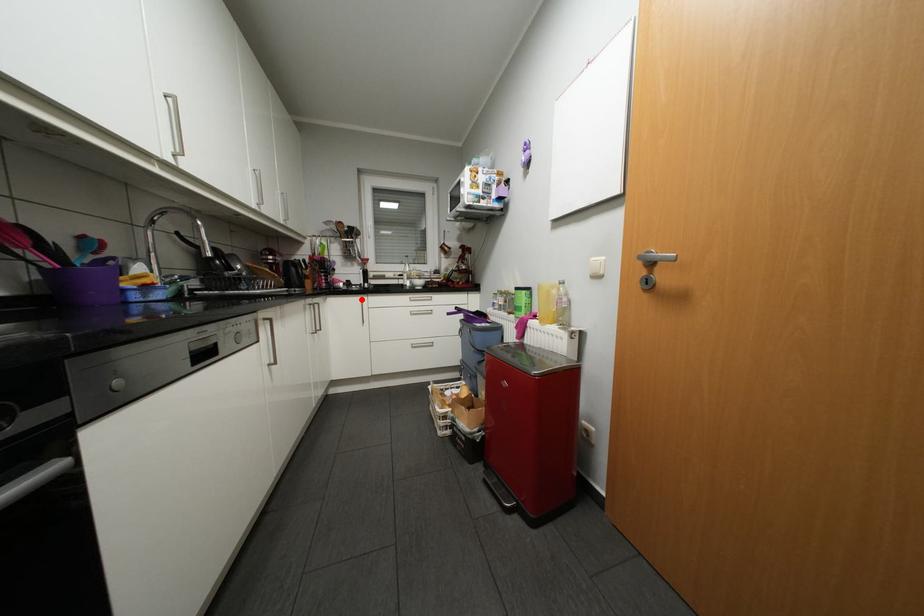
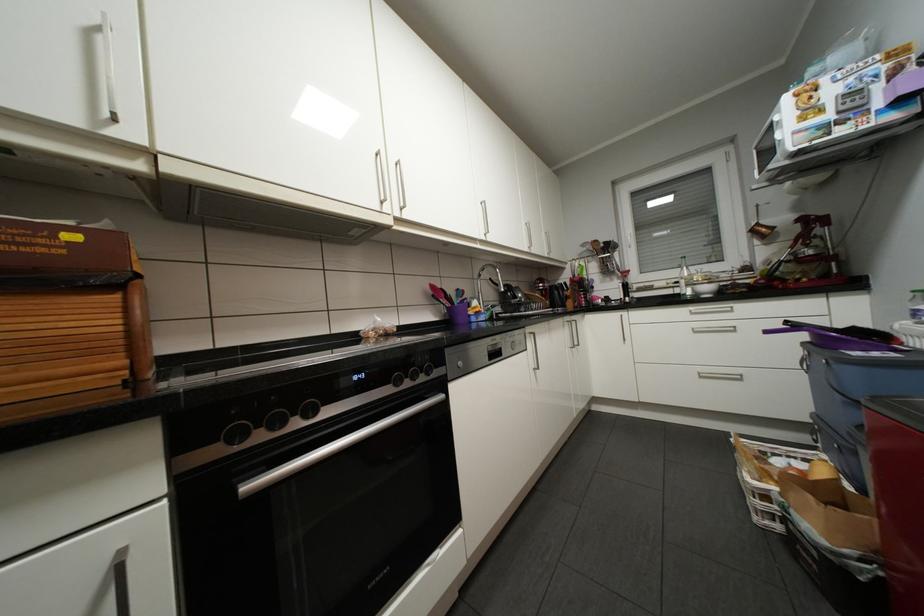
In the second image, find the point that corresponds to the highlighted location in the first image.

(619, 315)